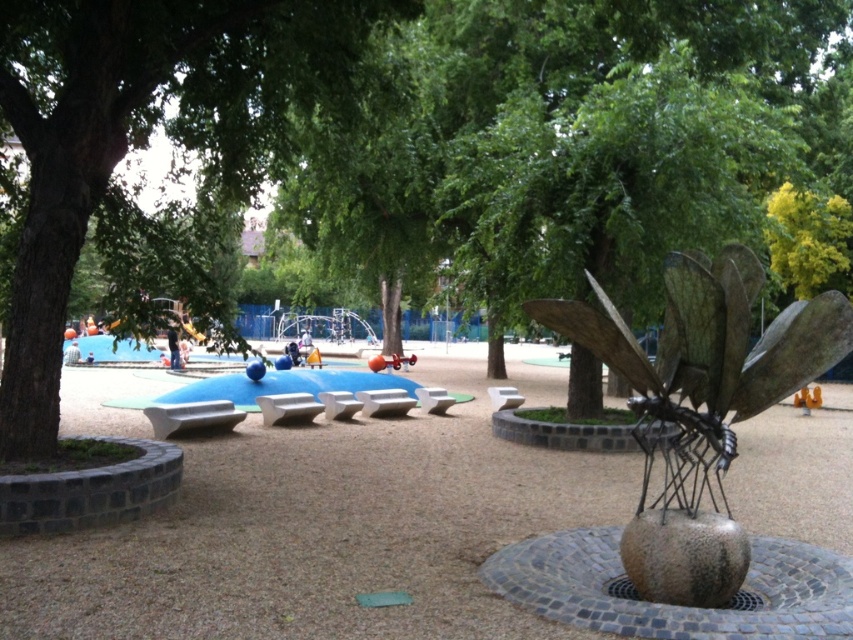
You are a park visitor standing at the entrance and want to take a photo of both the green leafy tree at left and the bronze metallic dragonfly at center. Which object will appear taller in the photo?

The bronze metallic dragonfly at center will appear taller in the photo because it is taller than the green leafy tree at left.

Based on the photo, you are a park visitor standing at the entrance and see the green leafy tree at left and the bronze metallic dragonfly at center. Which object is positioned further to your right side?

The bronze metallic dragonfly at center is positioned further to the right side compared to the green leafy tree at left.